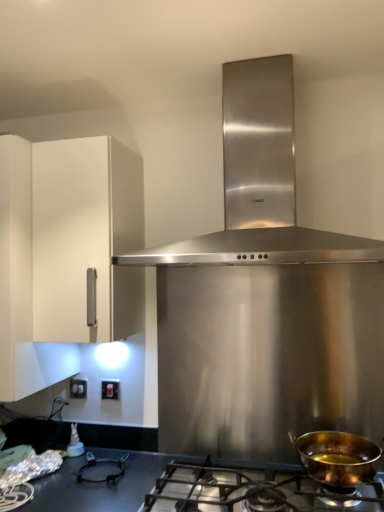
Question: Can you confirm if shiny copper pan at lower right is wider than stainless steel range hood at center?

Choices:
 (A) yes
 (B) no

Answer: (B)

Question: From a real-world perspective, does shiny copper pan at lower right sit lower than stainless steel range hood at center?

Choices:
 (A) yes
 (B) no

Answer: (A)

Question: Is the depth of shiny copper pan at lower right greater than that of stainless steel range hood at center?

Choices:
 (A) no
 (B) yes

Answer: (B)

Question: Can you see shiny copper pan at lower right touching stainless steel range hood at center?

Choices:
 (A) no
 (B) yes

Answer: (A)

Question: From the image's perspective, is shiny copper pan at lower right on top of stainless steel range hood at center?

Choices:
 (A) yes
 (B) no

Answer: (B)

Question: From the image's perspective, is shiny metallic gas stove at lower center located above or below white matte cabinet at left?

Choices:
 (A) above
 (B) below

Answer: (B)

Question: Which is correct: shiny metallic gas stove at lower center is inside white matte cabinet at left, or outside of it?

Choices:
 (A) outside
 (B) inside

Answer: (A)

Question: Considering the positions of shiny metallic gas stove at lower center and white matte cabinet at left in the image, is shiny metallic gas stove at lower center bigger or smaller than white matte cabinet at left?

Choices:
 (A) small
 (B) big

Answer: (A)

Question: Is shiny metallic gas stove at lower center to the left or to the right of white matte cabinet at left in the image?

Choices:
 (A) left
 (B) right

Answer: (B)

Question: From a real-world perspective, is shiny copper pan at lower right physically located above or below matte black switch at lower left, the 1th electric outlet viewed from the front?

Choices:
 (A) above
 (B) below

Answer: (B)

Question: Is shiny copper pan at lower right to the left or to the right of matte black switch at lower left, which is counted as the second electric outlet, starting from the back, in the image?

Choices:
 (A) right
 (B) left

Answer: (A)

Question: From the image's perspective, relative to matte black switch at lower left, the 1th electric outlet viewed from the front, is shiny copper pan at lower right above or below?

Choices:
 (A) above
 (B) below

Answer: (B)

Question: Is shiny copper pan at lower right inside the boundaries of matte black switch at lower left, which is counted as the second electric outlet, starting from the back, or outside?

Choices:
 (A) outside
 (B) inside

Answer: (A)

Question: Is stainless steel range hood at center wider or thinner than white matte cabinet at left?

Choices:
 (A) wide
 (B) thin

Answer: (A)

Question: Would you say stainless steel range hood at center is to the left or to the right of white matte cabinet at left in the picture?

Choices:
 (A) right
 (B) left

Answer: (A)